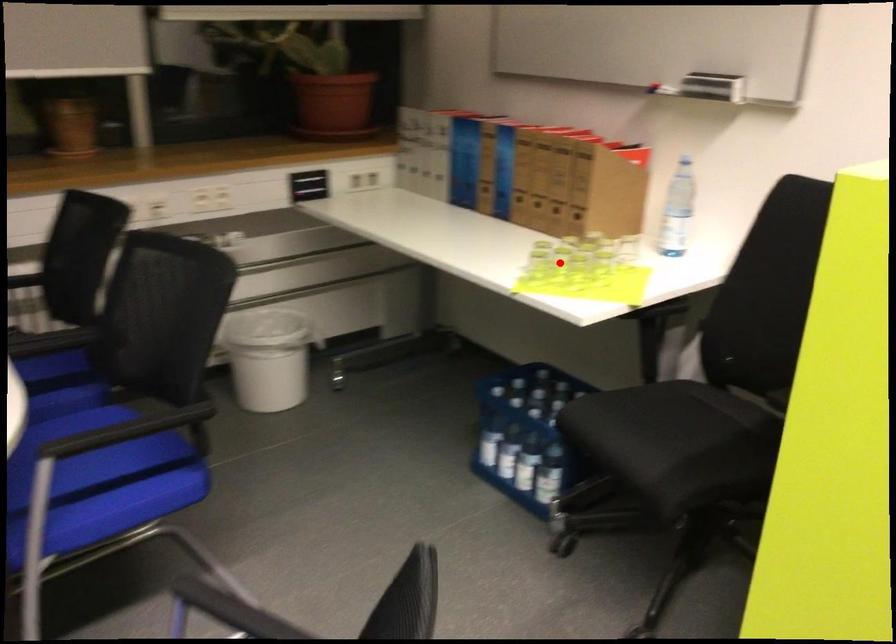
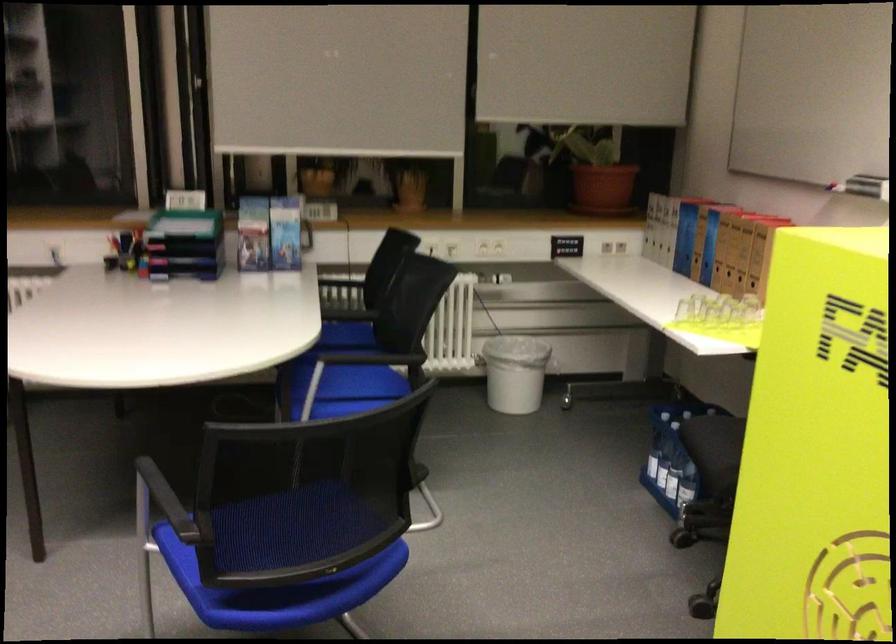
Question: I am providing you with two images of the same scene from different viewpoints. A red point is shown in image1. For the corresponding object point in image2, is it positioned nearer or farther from the camera?

Choices:
 (A) Nearer
 (B) Farther

Answer: (B)